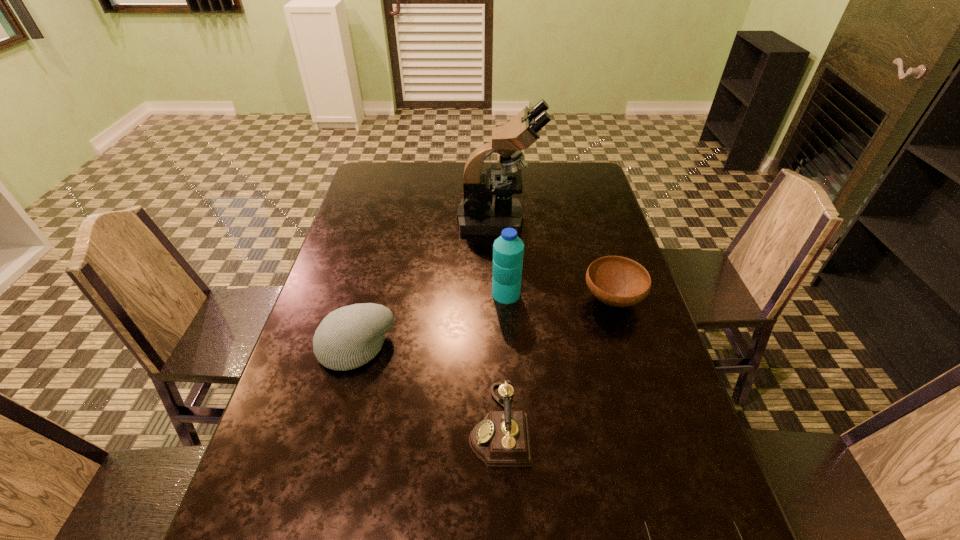
The width and height of the screenshot is (960, 540). Find the location of `vacant space that satisfies the following two spatial constraints: 1. on the front side of the bowl; 2. on the dial of the fifth farthest object`. vacant space that satisfies the following two spatial constraints: 1. on the front side of the bowl; 2. on the dial of the fifth farthest object is located at coordinates (651, 425).

You are a GUI agent. You are given a task and a screenshot of the screen. Output one action in this format:
    pyautogui.click(x=<x>, y=<y>)
    Task: Click on the free location that satisfies the following two spatial constraints: 1. on the front side of the bowl; 2. on the dial of the fifth farthest object
    This screenshot has width=960, height=540.
    Given the screenshot: What is the action you would take?
    651,425